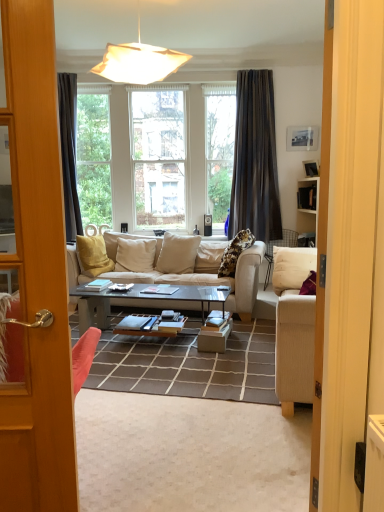
Question: In terms of height, does matte white pendant light at upper center look taller or shorter compared to shiny black glass coffee table at center?

Choices:
 (A) short
 (B) tall

Answer: (B)

Question: From the image's perspective, is matte white pendant light at upper center above or below shiny black glass coffee table at center?

Choices:
 (A) above
 (B) below

Answer: (A)

Question: Which of these objects is positioned closest to the beige fabric couch at center?

Choices:
 (A) shiny black glass coffee table at center
 (B) dark gray fabric curtain at upper center
 (C) matte white pendant light at upper center

Answer: (A)

Question: Which object is the closest to the shiny black glass coffee table at center?

Choices:
 (A) matte white pendant light at upper center
 (B) dark gray fabric curtain at upper center
 (C) beige fabric couch at center

Answer: (C)